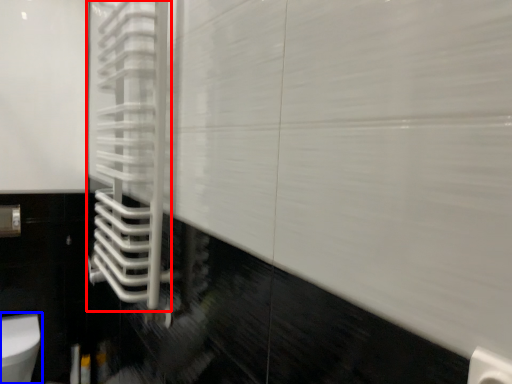
Question: Which object is closer to the camera taking this photo, shower door (highlighted by a red box) or toilet (highlighted by a blue box)?

Choices:
 (A) shower door
 (B) toilet

Answer: (A)